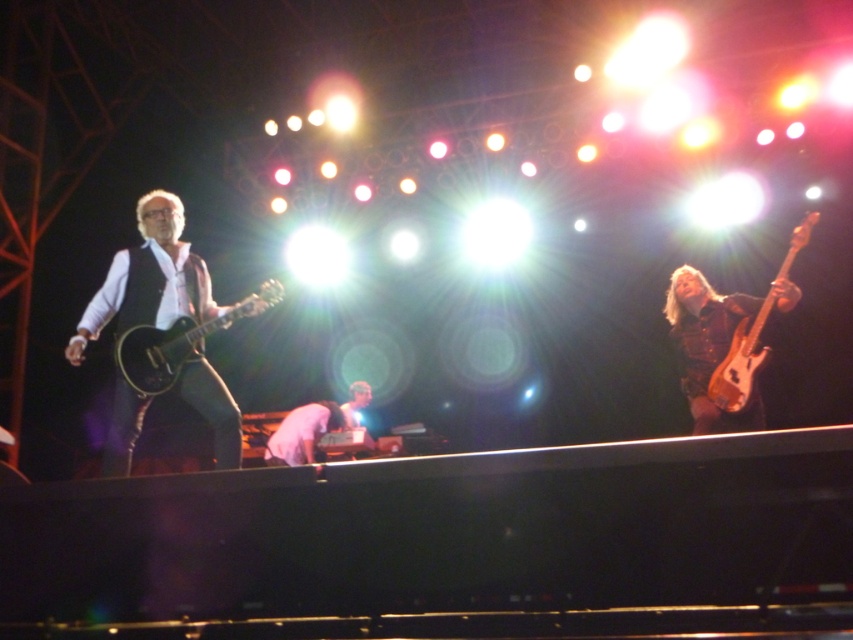
Which is more to the left, shiny black electric guitar at left or pink fabric shirt at center?

pink fabric shirt at center is more to the left.

How much distance is there between shiny black electric guitar at left and pink fabric shirt at center?

They are 7.54 feet apart.

Identify the location of shiny black electric guitar at left. (178, 342).

At what (x,y) coordinates should I click in order to perform the action: click on shiny black electric guitar at left. Please return your answer as a coordinate pair (x, y). This screenshot has width=853, height=640. Looking at the image, I should click on (178, 342).

How much distance is there between shiny black electric guitar at left and wooden electric guitar at right?

The distance of shiny black electric guitar at left from wooden electric guitar at right is 9.09 feet.

Consider the image. Does shiny black electric guitar at left have a lesser width compared to wooden electric guitar at right?

No.

You are a GUI agent. You are given a task and a screenshot of the screen. Output one action in this format:
    pyautogui.click(x=<x>, y=<y>)
    Task: Click on the shiny black electric guitar at left
    
    Given the screenshot: What is the action you would take?
    pyautogui.click(x=178, y=342)

Who is more forward, (801, 227) or (318, 417)?

Point (801, 227)

Is wooden electric guitar at right thinner than pink fabric shirt at center?

No, wooden electric guitar at right is not thinner than pink fabric shirt at center.

Which is behind, point (729, 360) or point (292, 440)?

Positioned behind is point (292, 440).

Image resolution: width=853 pixels, height=640 pixels. In order to click on wooden electric guitar at right in this screenshot , I will do `click(741, 362)`.